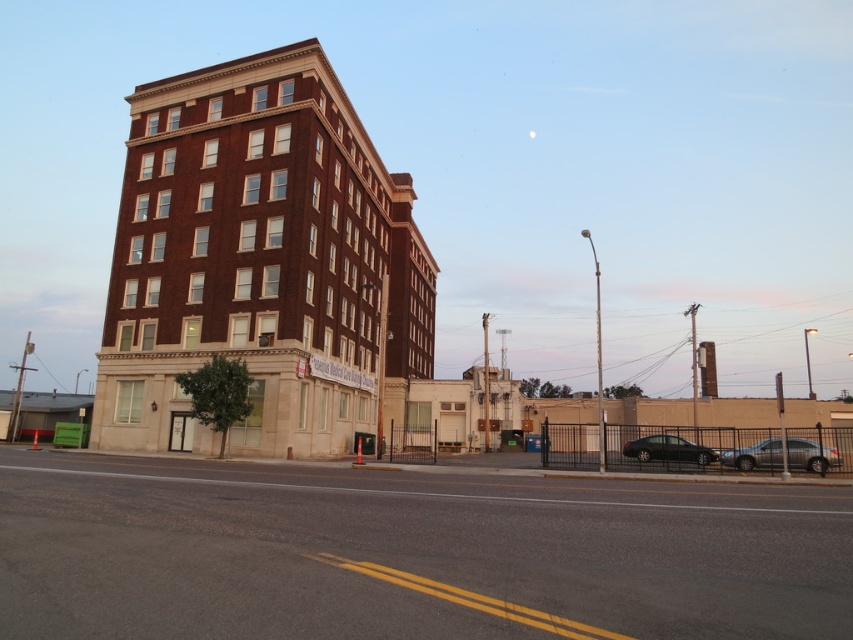
Question: Is satin silver sedan at lower right above black glossy sedan at lower right?

Choices:
 (A) yes
 (B) no

Answer: (A)

Question: Is satin silver sedan at lower right closer to camera compared to black glossy sedan at lower right?

Choices:
 (A) yes
 (B) no

Answer: (A)

Question: Does satin silver sedan at lower right have a lesser width compared to black glossy sedan at lower right?

Choices:
 (A) yes
 (B) no

Answer: (A)

Question: Among these points, which one is nearest to the camera?

Choices:
 (A) 648,436
 (B) 822,445

Answer: (B)

Question: Which of the following is the farthest from the observer?

Choices:
 (A) (788, 458)
 (B) (697, 456)

Answer: (B)

Question: Which of the following is the closest to the observer?

Choices:
 (A) satin silver sedan at lower right
 (B) black glossy sedan at lower right

Answer: (A)